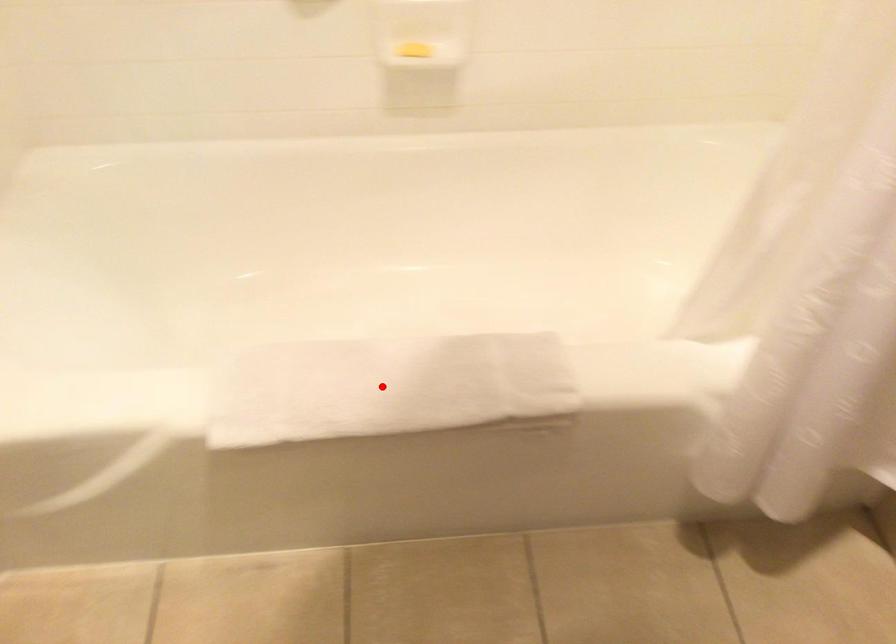
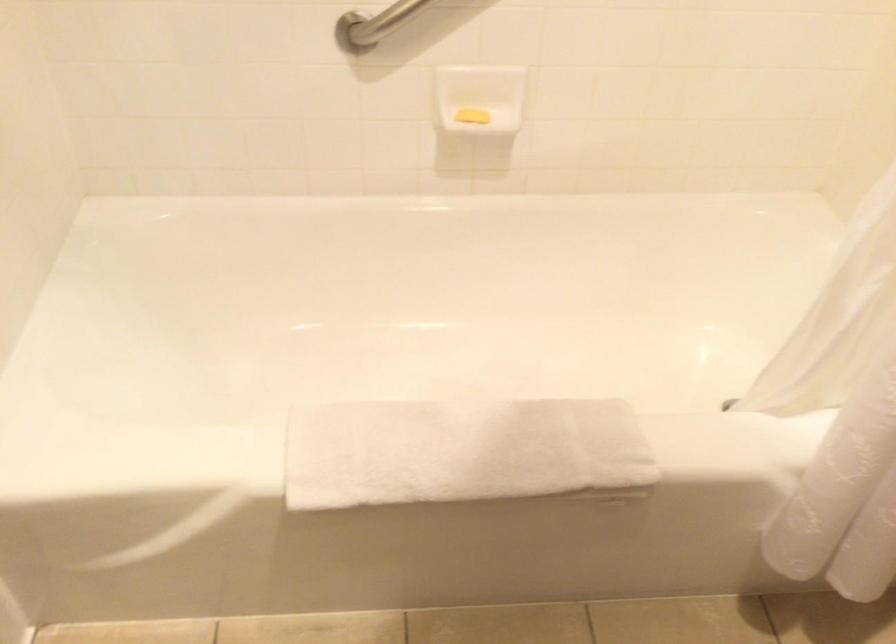
The point at the highlighted location is marked in the first image. Where is the corresponding point in the second image?

(460, 451)